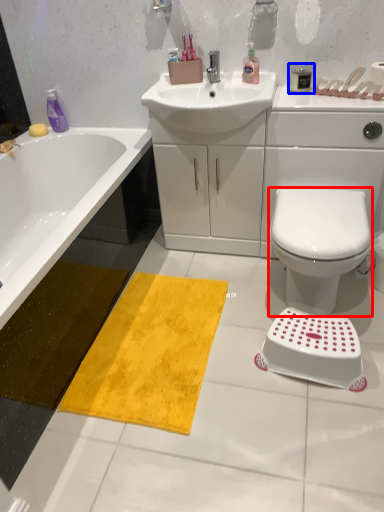
Question: Among these objects, which one is nearest to the camera, bidet (highlighted by a red box) or toiletry (highlighted by a blue box)?

Choices:
 (A) bidet
 (B) toiletry

Answer: (A)